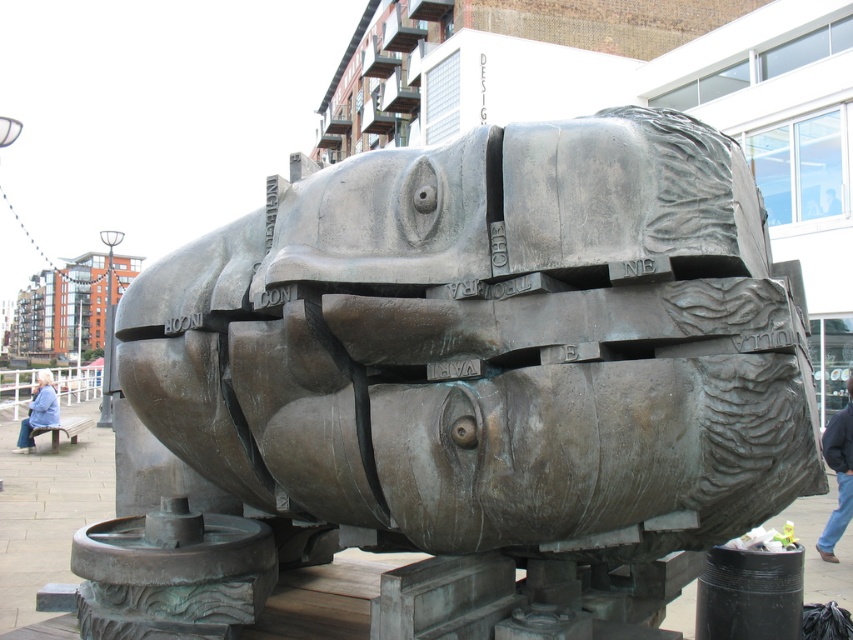
Question: From the image, what is the correct spatial relationship of bronze fish at center in relation to blue denim jacket at lower left?

Choices:
 (A) right
 (B) left

Answer: (A)

Question: Is bronze fish at center behind blue jeans at lower right?

Choices:
 (A) yes
 (B) no

Answer: (B)

Question: Which object is positioned closest to the blue jeans at lower right?

Choices:
 (A) blue denim jacket at lower left
 (B) bronze fish at center

Answer: (B)

Question: Which point is farther to the camera?

Choices:
 (A) (846, 509)
 (B) (16, 440)

Answer: (B)

Question: Which point is closer to the camera?

Choices:
 (A) blue jeans at lower right
 (B) blue denim jacket at lower left

Answer: (A)

Question: Can you confirm if blue jeans at lower right is thinner than blue denim jacket at lower left?

Choices:
 (A) yes
 (B) no

Answer: (A)